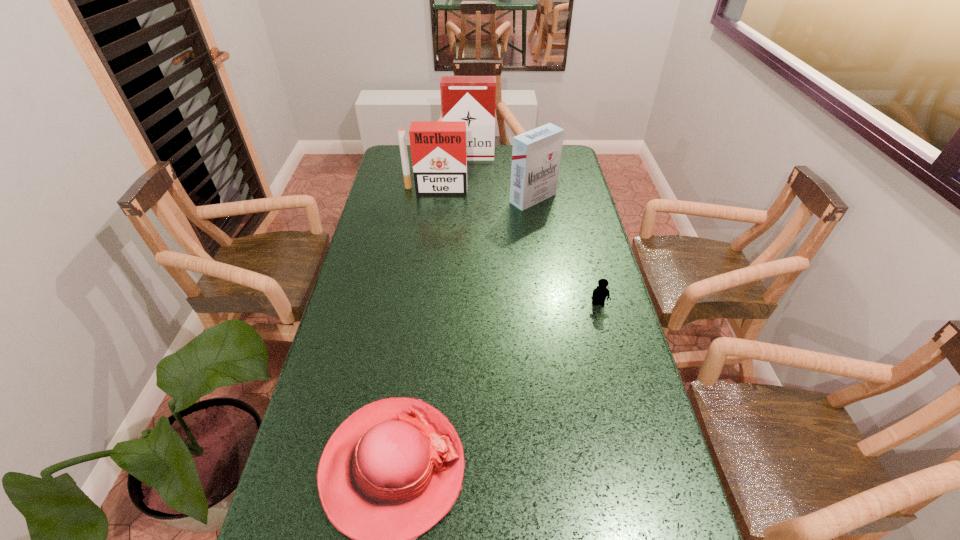
I want to click on cigarette case present at the right edge, so click(536, 154).

Image resolution: width=960 pixels, height=540 pixels. Find the location of `Lego present at the right edge`. Lego present at the right edge is located at coordinates (600, 293).

Find the location of a particular element. free space at the left edge of the desktop is located at coordinates (323, 401).

You are a GUI agent. You are given a task and a screenshot of the screen. Output one action in this format:
    pyautogui.click(x=<x>, y=<y>)
    Task: Click on the free space at the right edge
    
    Given the screenshot: What is the action you would take?
    pyautogui.click(x=551, y=231)

At what (x,y) coordinates should I click in order to perform the action: click on vacant area at the far right corner of the desktop. Please return your answer as a coordinate pair (x, y). The width and height of the screenshot is (960, 540). Looking at the image, I should click on (565, 167).

Where is `free space between the farthest object and the second object from right to left`? free space between the farthest object and the second object from right to left is located at coordinates (501, 177).

Select which object appears as the second closest to the shortest object. Please provide its 2D coordinates. Your answer should be formatted as a tuple, i.e. [(x, y)], where the tuple contains the x and y coordinates of a point satisfying the conditions above.

[(393, 469)]

Locate which object ranks in proximity to the rightmost cigarette case. Please provide its 2D coordinates. Your answer should be formatted as a tuple, i.e. [(x, y)], where the tuple contains the x and y coordinates of a point satisfying the conditions above.

[(439, 154)]

Find the location of a particular element. This screenshot has height=540, width=960. the closest cigarette case to the rightmost cigarette case is located at coordinates (439, 154).

Identify the location of cigarette case that is the second nearest to the farthest object. This screenshot has width=960, height=540. (536, 154).